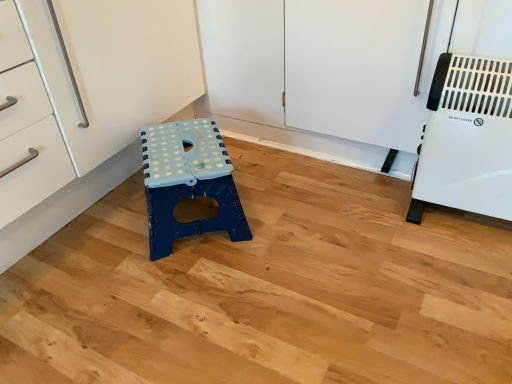
The image size is (512, 384). In order to click on vacant space in white plastic heater at right (from a real-world perspective) in this screenshot , I will do `click(461, 222)`.